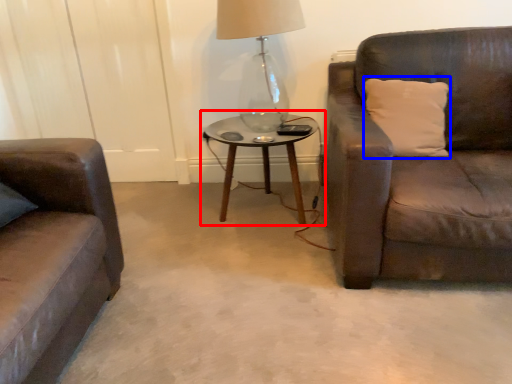
Question: Which object is closer to the camera taking this photo, coffee table (highlighted by a red box) or pillow (highlighted by a blue box)?

Choices:
 (A) coffee table
 (B) pillow

Answer: (B)